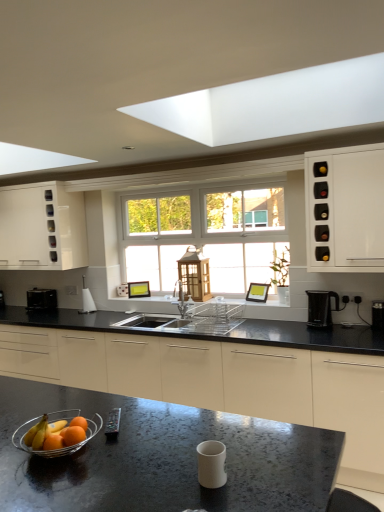
Find the location of a particular element. The image size is (384, 512). free space to the left of metallic silver faucet at center is located at coordinates (160, 320).